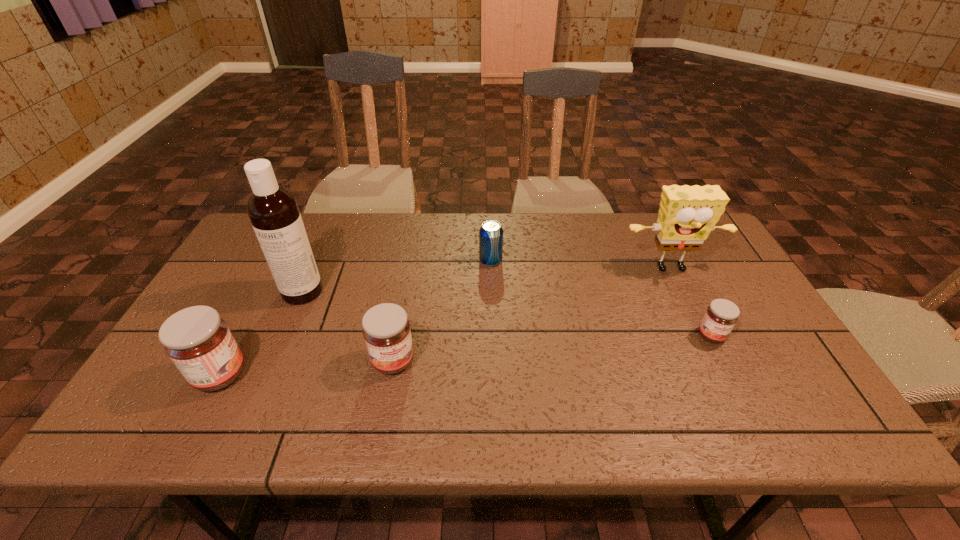
At what (x,y) coordinates should I click in order to perform the action: click on vacant space located 0.230m on the left of the shortest jam. Please return your answer as a coordinate pair (x, y). This screenshot has height=540, width=960. Looking at the image, I should click on (608, 335).

This screenshot has width=960, height=540. In order to click on blank area located on the back of the beer can in this screenshot , I will do `click(490, 224)`.

The width and height of the screenshot is (960, 540). I want to click on vacant space located on the front-facing side of the sponge, so click(x=703, y=333).

You are a GUI agent. You are given a task and a screenshot of the screen. Output one action in this format:
    pyautogui.click(x=<x>, y=<y>)
    Task: Click on the vacant space located on the label side of the tallest object
    Image resolution: width=960 pixels, height=540 pixels.
    Given the screenshot: What is the action you would take?
    pyautogui.click(x=277, y=349)

Locate an element on the screen. This screenshot has width=960, height=540. object that is at the far edge is located at coordinates (491, 233).

Find the location of a particular element. object present at the left edge is located at coordinates 198,341.

Where is `jam positioned at the right edge`? This screenshot has width=960, height=540. jam positioned at the right edge is located at coordinates (721, 315).

Find the location of `sponge that is positioned at the right edge`. sponge that is positioned at the right edge is located at coordinates (687, 214).

In order to click on object that is at the near left corner in this screenshot , I will do `click(198, 341)`.

In the image, there is a desktop. What are the coordinates of `vacant space at the far edge` in the screenshot? It's located at (426, 252).